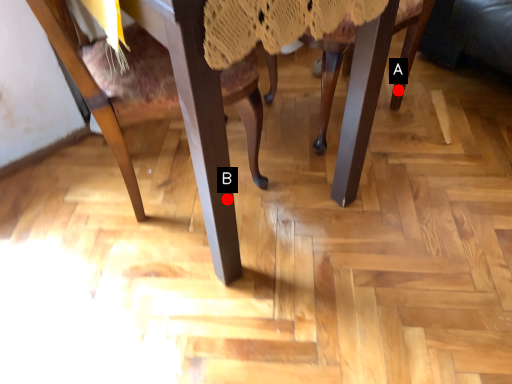
Question: Two points are circled on the image, labeled by A and B beside each circle. Which of the following is the closest to the observer?

Choices:
 (A) A is closer
 (B) B is closer

Answer: (B)